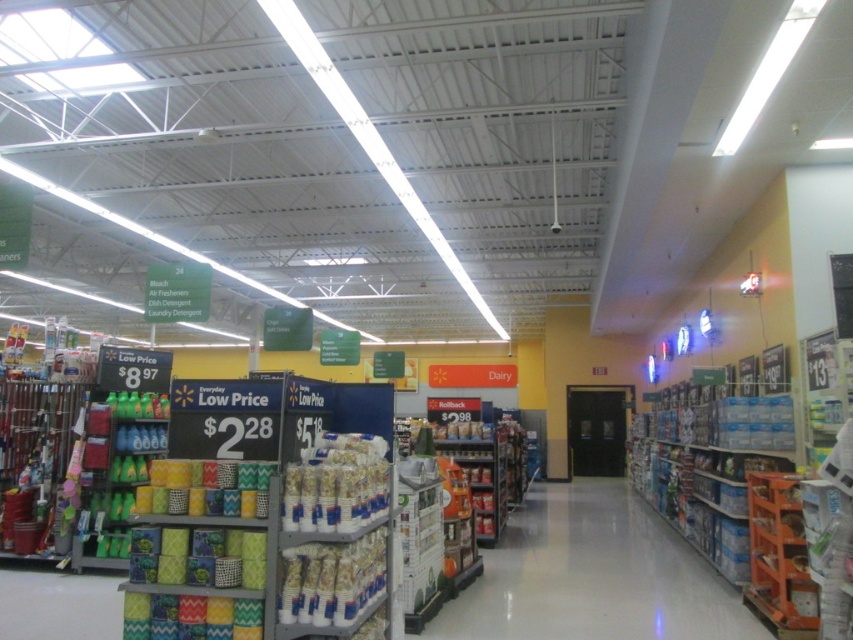
You are standing in the Walmart section and want to reach a product located at point (100, 484). There is an obstacle at point (332, 486). Which point is closer to you?

Point (100, 484) is closer to you because it is further to the camera than point (332, 486).

You are a customer in a Walmart store holding a shopping basket that is 0.5 meters wide. You want to walk from the matte plastic bottles at left to the white paper towels at center. Is there enough space between them for you to pass through comfortably?

The distance between the matte plastic bottles at left and the white paper towels at center is 4.97 meters, which is more than enough space for you to comfortably walk through with your 0.5 meter wide shopping basket.